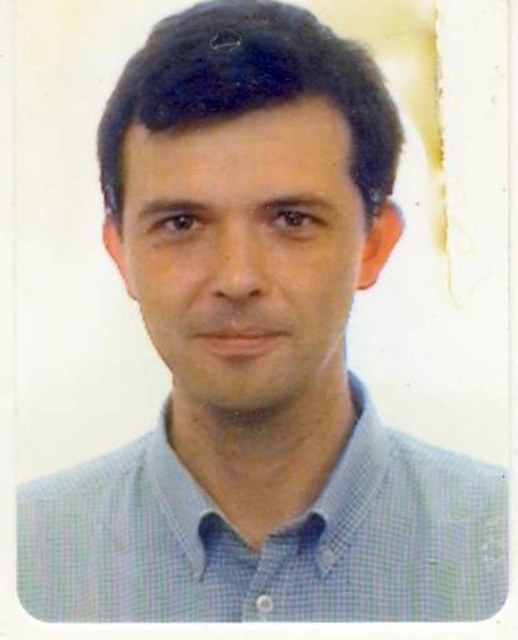
Looking at this image, you are designing a digital photo frame that needs to center a sticker exactly where the blue checkered dress shirt at center is located. The sticker should be placed at coordinates calculated from the center of the image. What coordinates should you use for the sticker?

The sticker should be placed at coordinates corresponding to the 2D location of the blue checkered dress shirt at center, which is at point (267, 540).

You are designing a layered outfit for a professional event. You have a blue checkered dress shirt at center and a matte blue shirt at center. Which shirt should you place on top to ensure the blue checkered pattern is visible?

The blue checkered dress shirt at center is positioned under matte blue shirt at center, so to make the checkered pattern visible, the matte blue shirt at center should be placed on top.